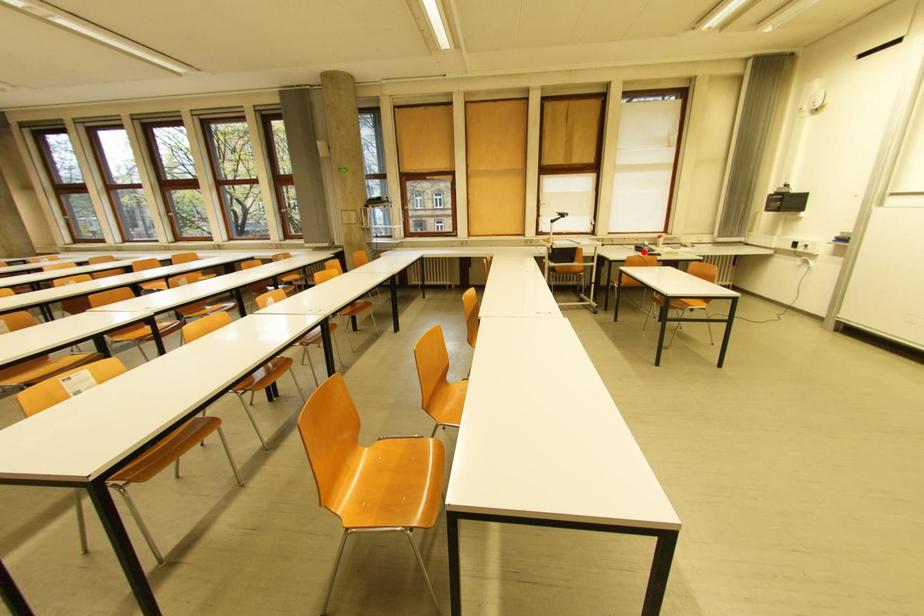
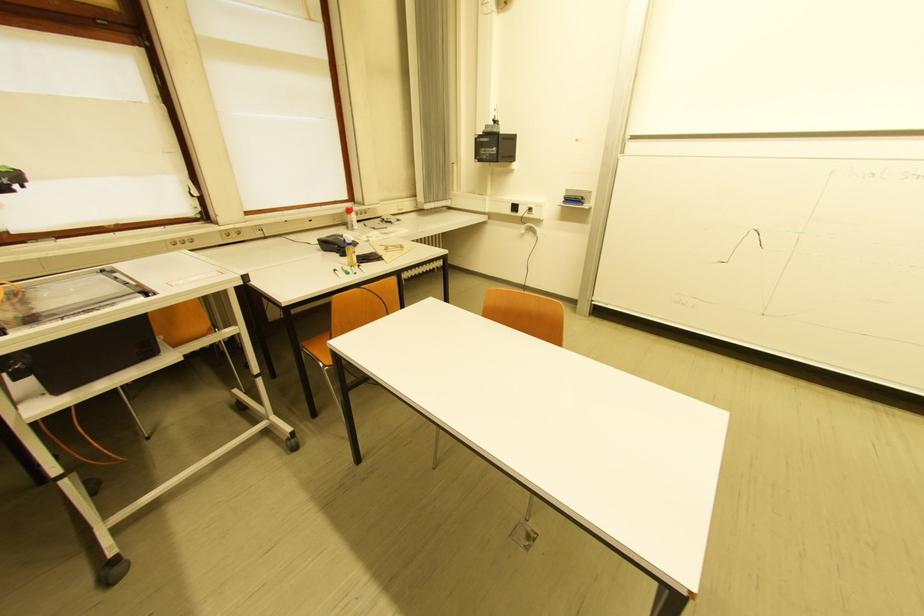
Find the pixel in the second image that matches the highlighted location in the first image.

(332, 252)